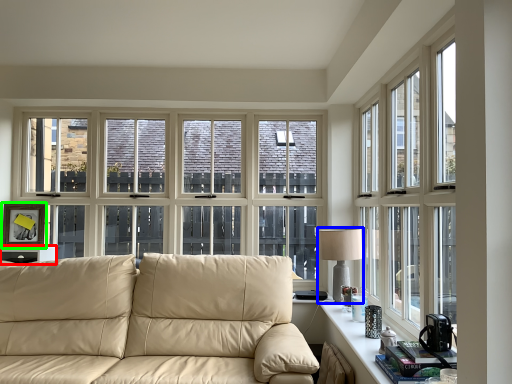
Question: Which object is the farthest from side table (highlighted by a red box)? Choose among these: table lamp (highlighted by a blue box) or picture frame (highlighted by a green box).

Choices:
 (A) table lamp
 (B) picture frame

Answer: (A)